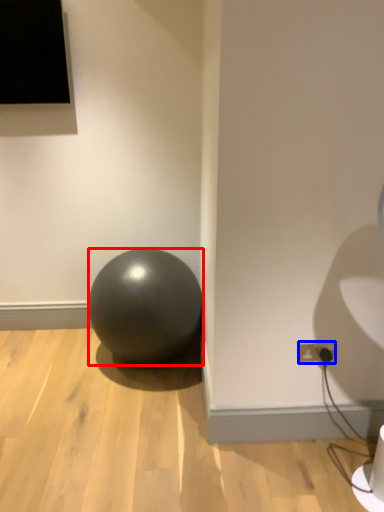
Question: Which point is closer to the camera, ball (highlighted by a red box) or electric outlet (highlighted by a blue box)?

Choices:
 (A) ball
 (B) electric outlet

Answer: (B)